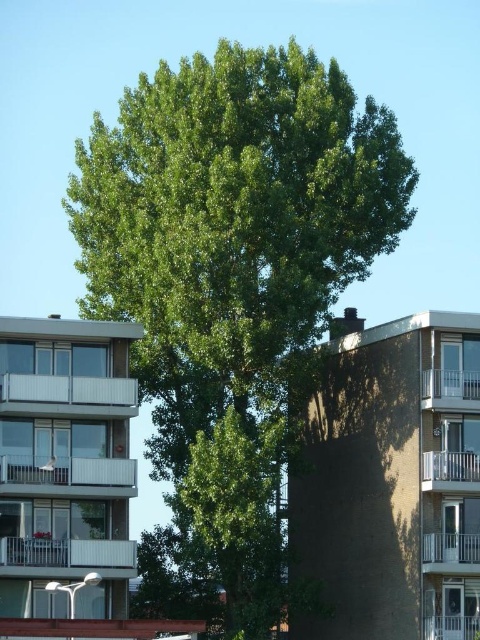
Question: Does green leafy tree at center have a lesser width compared to white glossy balcony at lower left?

Choices:
 (A) no
 (B) yes

Answer: (A)

Question: Is white plastic balcony at lower right to the right of white plastic balcony at center-right from the viewer's perspective?

Choices:
 (A) no
 (B) yes

Answer: (B)

Question: Can you confirm if white plastic balcony at center-right is smaller than white metal balcony at upper right?

Choices:
 (A) yes
 (B) no

Answer: (A)

Question: Which object is the farthest from the white metal balcony at upper right?

Choices:
 (A) white glass balcony at left
 (B) green leafy tree at center

Answer: (A)

Question: Based on their relative distances, which object is farther from the white plastic balcony at center-right?

Choices:
 (A) white glass balcony at left
 (B) white glossy balcony at left
 (C) green leafy tree at center
 (D) white metal balcony at upper right

Answer: (B)

Question: Based on their relative distances, which object is nearer to the white plastic balcony at center-right?

Choices:
 (A) white metal balcony at upper right
 (B) white glass balcony at left
 (C) green leafy tree at center
 (D) white plastic balcony at lower right

Answer: (D)